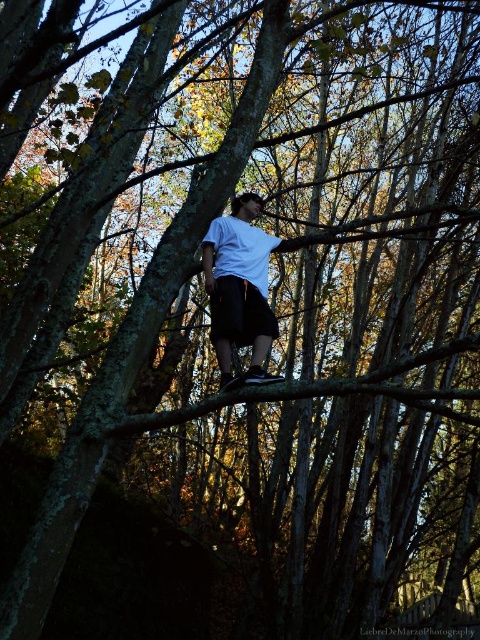
Is white matte shirt at center above black matte shorts at center?

Yes.

Between white matte shirt at center and black matte shorts at center, which one has less height?

black matte shorts at center is shorter.

Does point (239, 198) lie in front of point (244, 328)?

No, (239, 198) is further to viewer.

Find the location of a particular element. white matte shirt at center is located at coordinates (240, 289).